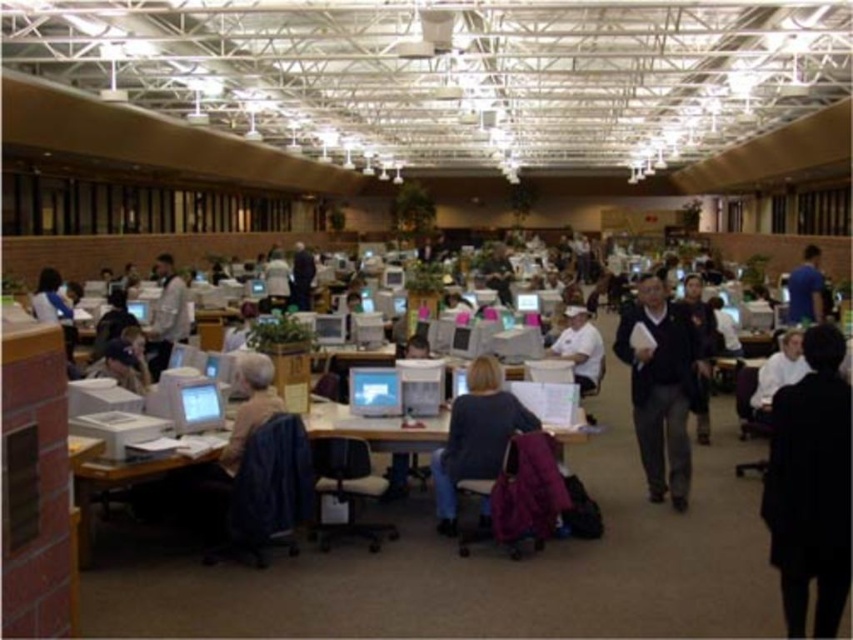
Between black fabric coat at lower right and white matte baseball cap at center, which one is positioned higher?

white matte baseball cap at center is above.

Is black fabric coat at lower right positioned in front of white matte baseball cap at center?

Yes, black fabric coat at lower right is closer to the viewer.

Find the location of `black fabric coat at lower right`. black fabric coat at lower right is located at coordinates (810, 486).

Can you confirm if dark gray sweater at center is positioned below dark blue jacket at center?

Incorrect, dark gray sweater at center is not positioned below dark blue jacket at center.

The width and height of the screenshot is (853, 640). What do you see at coordinates (660, 387) in the screenshot?
I see `dark gray sweater at center` at bounding box center [660, 387].

This screenshot has height=640, width=853. What are the coordinates of `dark gray sweater at center` in the screenshot? It's located at 660,387.

Is point (257, 422) positioned behind point (802, 257)?

No, (257, 422) is closer to viewer.

Who is more forward, [267,401] or [791,292]?

Point [267,401] is more forward.

This screenshot has width=853, height=640. Find the location of `matte blue shirt at center`. matte blue shirt at center is located at coordinates (248, 406).